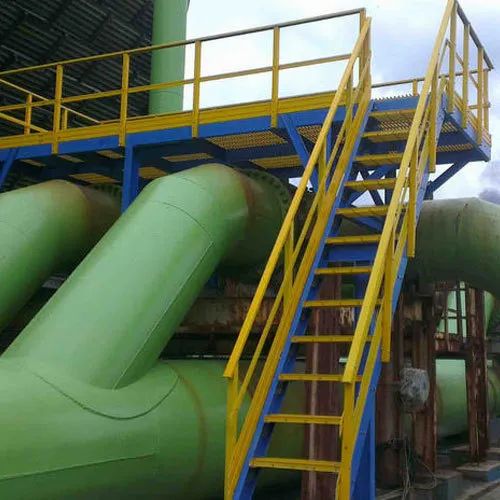
I want to click on 7th stair, so click(x=376, y=233).